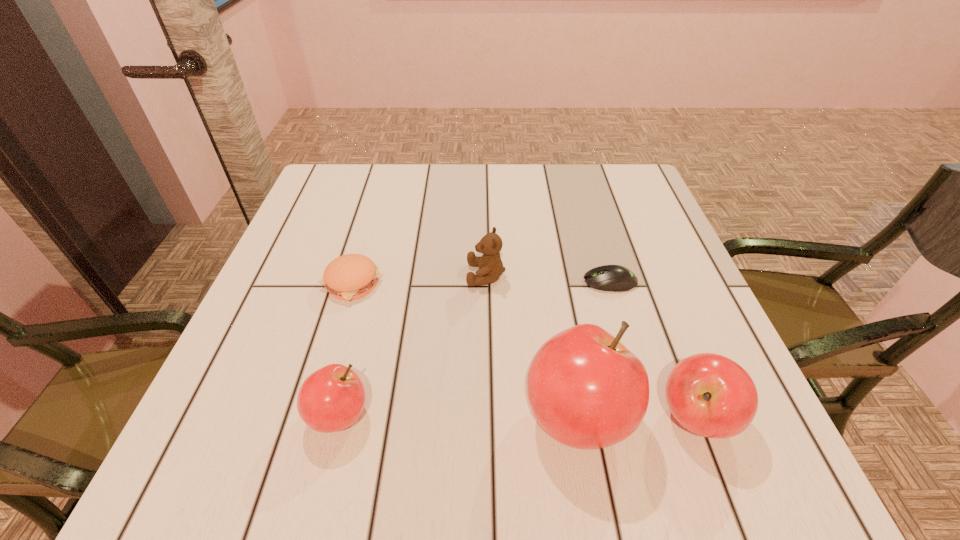
Find the location of a particular element. Image resolution: width=960 pixels, height=540 pixels. free location located on the front-facing side of the third object from left to right is located at coordinates (290, 275).

The width and height of the screenshot is (960, 540). I want to click on vacant space situated on the front-facing side of the third object from left to right, so click(388, 275).

In order to click on vacant space situated 0.100m on the front-facing side of the third object from left to right in this screenshot , I will do pyautogui.click(x=420, y=275).

Find the location of a particular element. This screenshot has height=540, width=960. vacant space situated on the left of the patty is located at coordinates (278, 284).

The height and width of the screenshot is (540, 960). In order to click on vacant space located on the wheel side of the shortest object in this screenshot , I will do `click(426, 282)`.

You are a GUI agent. You are given a task and a screenshot of the screen. Output one action in this format:
    pyautogui.click(x=<x>, y=<y>)
    Task: Click on the free space located 0.050m on the wheel side of the shortest object
    Image resolution: width=960 pixels, height=540 pixels.
    Given the screenshot: What is the action you would take?
    pyautogui.click(x=560, y=282)

Identify the location of blank space located on the wheel side of the shortest object. (531, 282).

The width and height of the screenshot is (960, 540). In order to click on object located at the left edge in this screenshot , I will do `click(351, 276)`.

This screenshot has height=540, width=960. What are the coordinates of `apple that is positioned at the right edge` in the screenshot? It's located at coord(710,395).

In order to click on computer mouse that is at the right edge in this screenshot , I will do `click(614, 278)`.